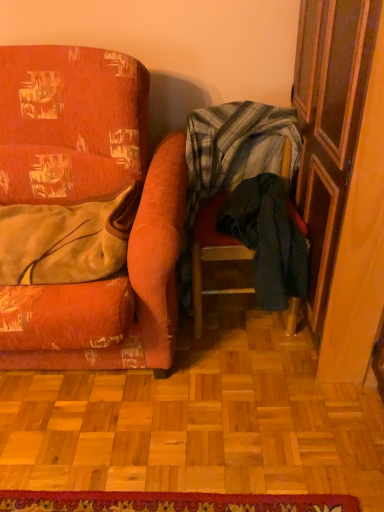
You are a GUI agent. You are given a task and a screenshot of the screen. Output one action in this format:
    pyautogui.click(x=<x>, y=<y>)
    Task: Click on the free space in front of plaid fabric chair at center, acting as the 1th chair starting from the right
    
    Given the screenshot: What is the action you would take?
    pyautogui.click(x=236, y=394)